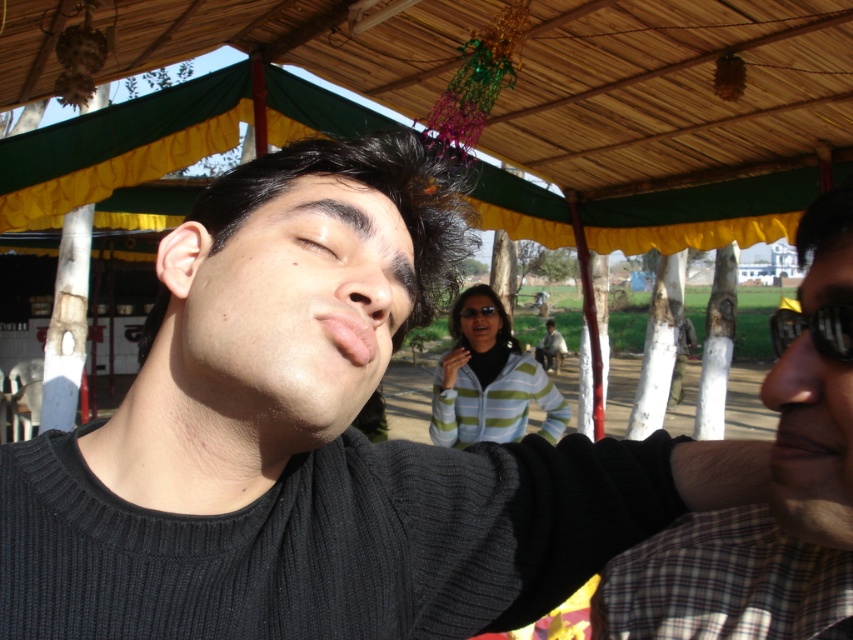
Between point (753, 83) and point (769, 577), which one is positioned in front?

Point (769, 577) is more forward.

Which is below, green fabric canopy at upper center or checkered fabric shirt at right?

Positioned lower is checkered fabric shirt at right.

The width and height of the screenshot is (853, 640). What do you see at coordinates (674, 92) in the screenshot?
I see `green fabric canopy at upper center` at bounding box center [674, 92].

This screenshot has height=640, width=853. What are the coordinates of `green fabric canopy at upper center` in the screenshot? It's located at (674, 92).

Is striped knit sweater at center shorter than brown matte eye at center?

No.

Is striped knit sweater at center further to the viewer compared to brown matte eye at center?

Yes, it is.

Who is more forward, (502, 404) or (339, 252)?

Point (339, 252)

Find the location of a particular element. striped knit sweater at center is located at coordinates (488, 380).

How distant is black rubber goggles at right from brown matte eye at center?

black rubber goggles at right and brown matte eye at center are 12.92 inches apart from each other.

Is black rubber goggles at right wider than brown matte eye at center?

Yes.

What do you see at coordinates (815, 330) in the screenshot? I see `black rubber goggles at right` at bounding box center [815, 330].

Identify the location of black rubber goggles at right. The height and width of the screenshot is (640, 853). (815, 330).